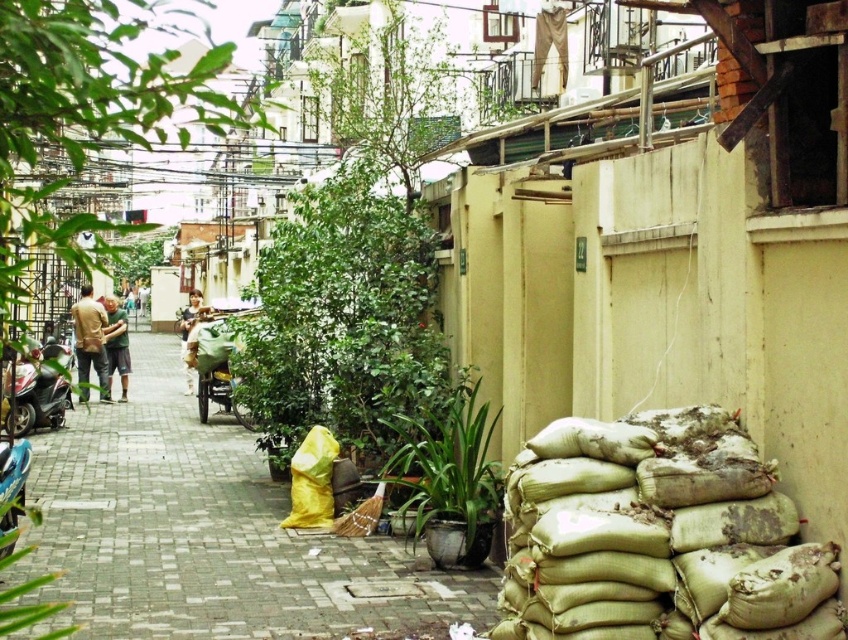
Question: Does brown leather jacket at center appear over green matte shirt at center?

Choices:
 (A) no
 (B) yes

Answer: (A)

Question: Which point is farther to the camera?

Choices:
 (A) gray concrete pavement at center
 (B) brown leather jacket at center

Answer: (B)

Question: Can you confirm if brown leather jacket at center is thinner than green matte shirt at center?

Choices:
 (A) yes
 (B) no

Answer: (A)

Question: Which point is farther to the camera?

Choices:
 (A) green matte shirt at center
 (B) gray concrete pavement at center

Answer: (A)

Question: Does brown leather jacket at center appear on the left side of green matte shirt at center?

Choices:
 (A) yes
 (B) no

Answer: (B)

Question: Which is farther from the shiny metallic scooter at left?

Choices:
 (A) gray concrete pavement at center
 (B) green matte shirt at center

Answer: (B)